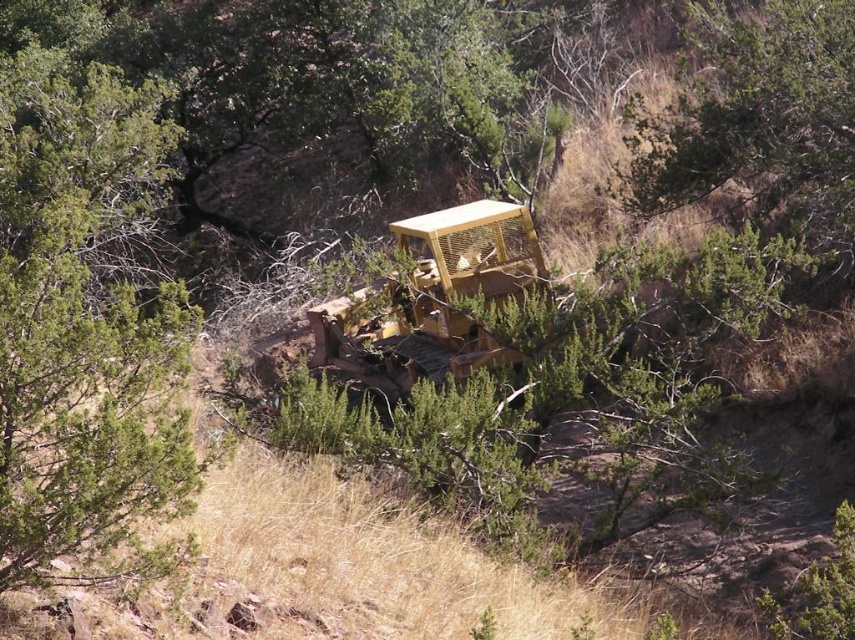
You are standing in front of the yellow bulldozer surrounded by vegetation. You notice two points marked on the image. The first point is at coordinate (x=848, y=218) and the second at (x=414, y=353). Which point is nearer to you?

Point (x=848, y=218) is closer to the viewer than point (x=414, y=353).

You are a hiker who wants to take a photo of the yellow metallic tractor at center without the green leafy tree at center blocking the view. How should you adjust your position?

Move further away from the green leafy tree at center so that it becomes smaller in your view, allowing the yellow metallic tractor at center to be visible without obstruction.

Consider the image. You are a drone operator trying to navigate between two points in the image. The first point is point (87, 352) and the second point is point (805, 145). Which point is closer to the bulldozer?

Point (87, 352) is in front of point (805, 145), so it is closer to the bulldozer.